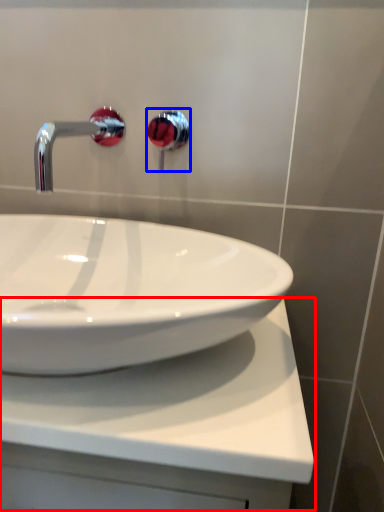
Question: Among these objects, which one is farthest to the camera, counter top (highlighted by a red box) or plumbing fixture (highlighted by a blue box)?

Choices:
 (A) counter top
 (B) plumbing fixture

Answer: (B)